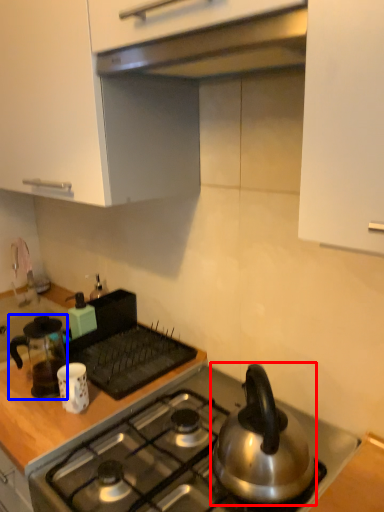
Question: Which object is further to the camera taking this photo, kettle (highlighted by a red box) or kitchen appliance (highlighted by a blue box)?

Choices:
 (A) kettle
 (B) kitchen appliance

Answer: (B)